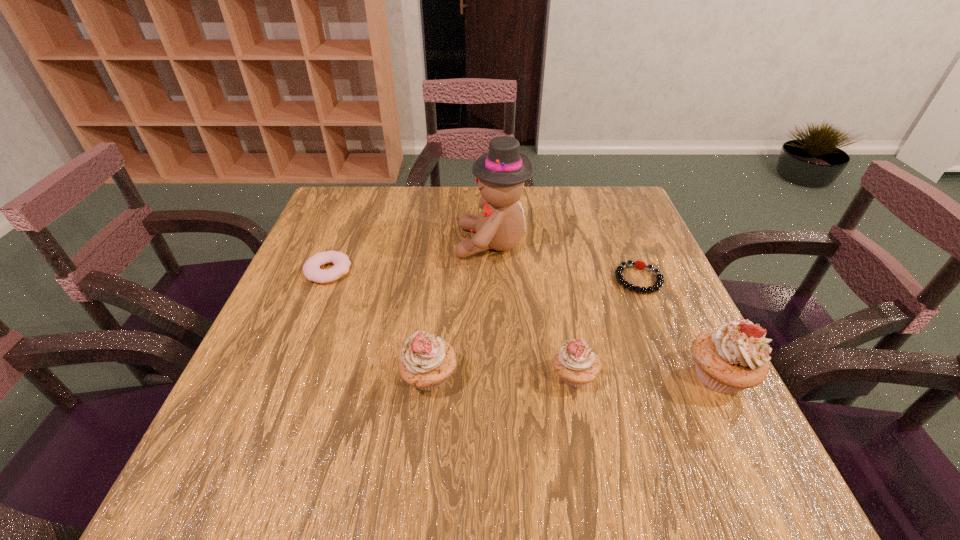
Please show where to add a cupcake on the left while keeping spacing even. Please provide its 2D coordinates. Your answer should be formatted as a tuple, i.e. [(x, y)], where the tuple contains the x and y coordinates of a point satisfying the conditions above.

[(284, 377)]